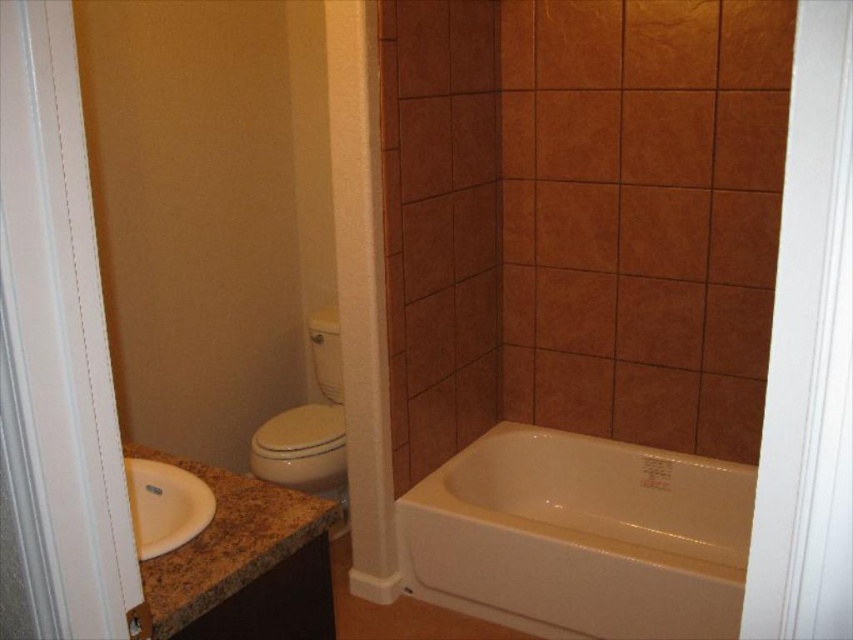
Question: Can you confirm if white glossy toilet bowl at center-left is bigger than white glossy sink at lower left?

Choices:
 (A) yes
 (B) no

Answer: (A)

Question: Which object appears closest to the camera in this image?

Choices:
 (A) white glossy bathtub at lower right
 (B) white glossy toilet bowl at center-left

Answer: (A)

Question: Which point is closer to the camera?

Choices:
 (A) white glossy toilet bowl at center-left
 (B) white glossy sink at lower left

Answer: (B)

Question: Which point is farther from the camera taking this photo?

Choices:
 (A) coord(202,484)
 (B) coord(619,625)
 (C) coord(323,316)

Answer: (C)

Question: Is white glossy bathtub at lower right positioned before white glossy sink at lower left?

Choices:
 (A) yes
 (B) no

Answer: (B)

Question: Is white glossy bathtub at lower right bigger than white glossy sink at lower left?

Choices:
 (A) no
 (B) yes

Answer: (B)